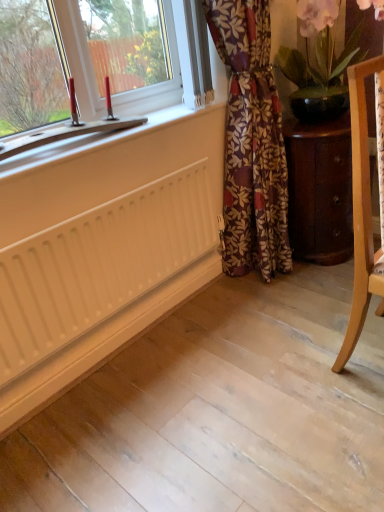
This screenshot has height=512, width=384. What do you see at coordinates (320, 189) in the screenshot? I see `wooden cabinet at lower right` at bounding box center [320, 189].

Find the location of a particular element. This screenshot has height=512, width=384. matte black pot at upper right is located at coordinates (283, 23).

In order to face floral fabric curtain at center, should I rotate leftwards or rightwards?

A 8.176 degree turn to the right will do.

What is the approximate height of floral fabric curtain at center?

1.19 meters.

Identify the location of wooden cabinet at lower right. This screenshot has width=384, height=512. (320, 189).

From the picture: Can you confirm if wooden cabinet at lower right is shorter than white matte radiator at lower left?

Incorrect, the height of wooden cabinet at lower right does not fall short of that of white matte radiator at lower left.

What's the angular difference between wooden cabinet at lower right and white matte radiator at lower left's facing directions?

They differ by 3.76 degrees in their facing directions.

Does wooden cabinet at lower right have a smaller size compared to white matte radiator at lower left?

Incorrect, wooden cabinet at lower right is not smaller in size than white matte radiator at lower left.

Does wooden cabinet at lower right have a greater width compared to white matte radiator at lower left?

Yes.

Are floral fabric curtain at center and matte black pot at upper right making contact?

No, floral fabric curtain at center is not in contact with matte black pot at upper right.

Considering the relative sizes of floral fabric curtain at center and matte black pot at upper right in the image provided, is floral fabric curtain at center smaller than matte black pot at upper right?

No.

Is floral fabric curtain at center positioned with its back to matte black pot at upper right?

No.

Is matte black pot at upper right to the right of light wood chair at right from the viewer's perspective?

No.

From a real-world perspective, is matte black pot at upper right above or below light wood chair at right?

Clearly, from a real-world perspective, matte black pot at upper right is above light wood chair at right.

Between matte black pot at upper right and light wood chair at right, which one has less height?

matte black pot at upper right.

Which point is more distant from viewer, (x=62, y=261) or (x=315, y=145)?

The point (x=315, y=145) is more distant.

In the scene shown: Does white matte radiator at lower left have a lesser width compared to wooden cabinet at lower right?

Yes.

You are a GUI agent. You are given a task and a screenshot of the screen. Output one action in this format:
    pyautogui.click(x=<x>, y=<y>)
    Task: Click on the furniture lying on the right of white matte radiator at lower left
    The image size is (384, 512).
    Given the screenshot: What is the action you would take?
    pyautogui.click(x=320, y=189)

Measure the distance between white matte radiator at lower left and wooden cabinet at lower right.

29.00 inches.

Is white matte radiator at lower left surrounding floral fabric curtain at center?

That's incorrect, floral fabric curtain at center is not inside white matte radiator at lower left.

Which of these two, white matte radiator at lower left or floral fabric curtain at center, stands taller?

Standing taller between the two is floral fabric curtain at center.

There is a white matte radiator at lower left. Identify the location of curtain above it (from a real-world perspective). This screenshot has height=512, width=384. (251, 142).

Is white matte radiator at lower left oriented away from floral fabric curtain at center?

No, white matte radiator at lower left's orientation is not away from floral fabric curtain at center.

Is white matte radiator at lower left far from light wood chair at right?

No, white matte radiator at lower left is not far from light wood chair at right.

From a real-world perspective, is white matte radiator at lower left over light wood chair at right?

Actually, white matte radiator at lower left is physically below light wood chair at right in the real world.

In terms of height, does white matte radiator at lower left look taller or shorter compared to light wood chair at right?

In the image, white matte radiator at lower left appears to be shorter than light wood chair at right.

How far apart are white matte radiator at lower left and light wood chair at right?

83.74 centimeters.

Is matte black pot at upper right far from white matte radiator at lower left?

Absolutely, matte black pot at upper right is distant from white matte radiator at lower left.

Which object is positioned more to the right, matte black pot at upper right or white matte radiator at lower left?

Positioned to the right is matte black pot at upper right.

Can you confirm if matte black pot at upper right is taller than white matte radiator at lower left?

Correct, matte black pot at upper right is much taller as white matte radiator at lower left.

What are the coordinates of `furniture directly beneath the white matte radiator at lower left (from a real-world perspective)` in the screenshot? It's located at (320, 189).

Where is `curtain on the left side of matte black pot at upper right`? curtain on the left side of matte black pot at upper right is located at coordinates [x=251, y=142].

From the image, which object appears to be farther from white matte radiator at lower left, matte black pot at upper right or wooden cabinet at lower right?

matte black pot at upper right lies further to white matte radiator at lower left than the other object.

Looking at the image, which one is located further to wooden cabinet at lower right, floral fabric curtain at center or light wood chair at right?

light wood chair at right is positioned further to the anchor wooden cabinet at lower right.

Estimate the real-world distances between objects in this image. Which object is further from white matte radiator at lower left, matte black pot at upper right or light wood chair at right?

The object further to white matte radiator at lower left is matte black pot at upper right.

Considering their positions, is matte black pot at upper right positioned closer to light wood chair at right than wooden cabinet at lower right?

wooden cabinet at lower right is closer to light wood chair at right.

From the image, which object appears to be farther from floral fabric curtain at center, white matte radiator at lower left or light wood chair at right?

light wood chair at right is positioned further to the anchor floral fabric curtain at center.

Which object lies nearer to the anchor point white matte radiator at lower left, floral fabric curtain at center or matte black pot at upper right?

floral fabric curtain at center is positioned closer to the anchor white matte radiator at lower left.

Estimate the real-world distances between objects in this image. Which object is closer to wooden cabinet at lower right, light wood chair at right or white matte radiator at lower left?

Among the two, light wood chair at right is located nearer to wooden cabinet at lower right.

Based on the photo, looking at the image, which one is located closer to matte black pot at upper right, wooden cabinet at lower right or light wood chair at right?

Among the two, wooden cabinet at lower right is located nearer to matte black pot at upper right.

Where is `curtain between matte black pot at upper right and wooden cabinet at lower right in the vertical direction`? This screenshot has height=512, width=384. curtain between matte black pot at upper right and wooden cabinet at lower right in the vertical direction is located at coordinates (251, 142).

The height and width of the screenshot is (512, 384). In order to click on curtain between white matte radiator at lower left and matte black pot at upper right from left to right in this screenshot , I will do `click(251, 142)`.

Find the location of a particular element. Image resolution: width=384 pixels, height=512 pixels. furniture located between white matte radiator at lower left and light wood chair at right in the left-right direction is located at coordinates [x=320, y=189].

The height and width of the screenshot is (512, 384). Find the location of `houseplant between white matte radiator at lower left and wooden cabinet at lower right`. houseplant between white matte radiator at lower left and wooden cabinet at lower right is located at coordinates (283, 23).